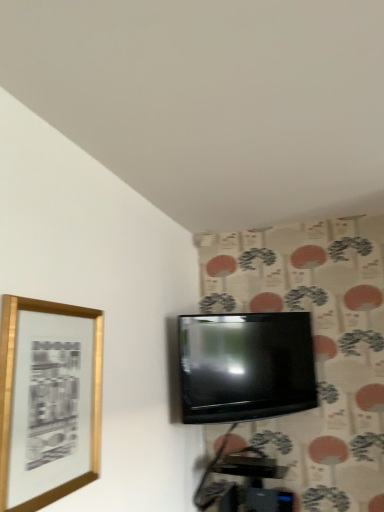
Question: Does gold metallic picture frame at left turn towards black glossy tv at center?

Choices:
 (A) no
 (B) yes

Answer: (A)

Question: Is gold metallic picture frame at left at the right side of black glossy tv at center?

Choices:
 (A) no
 (B) yes

Answer: (A)

Question: Is gold metallic picture frame at left behind black glossy tv at center?

Choices:
 (A) yes
 (B) no

Answer: (B)

Question: Can you confirm if gold metallic picture frame at left is smaller than black glossy tv at center?

Choices:
 (A) yes
 (B) no

Answer: (A)

Question: Can you confirm if gold metallic picture frame at left is shorter than black glossy tv at center?

Choices:
 (A) no
 (B) yes

Answer: (A)

Question: Is gold metallic picture frame at left far from black glossy tv at center?

Choices:
 (A) no
 (B) yes

Answer: (A)

Question: Is black glossy tv at center directly adjacent to gold metallic picture frame at left?

Choices:
 (A) yes
 (B) no

Answer: (B)

Question: Is black glossy tv at center smaller than gold metallic picture frame at left?

Choices:
 (A) no
 (B) yes

Answer: (A)

Question: Is black glossy tv at center wider than gold metallic picture frame at left?

Choices:
 (A) yes
 (B) no

Answer: (A)

Question: Is black glossy tv at center in front of gold metallic picture frame at left?

Choices:
 (A) no
 (B) yes

Answer: (A)

Question: Is black glossy tv at center oriented away from gold metallic picture frame at left?

Choices:
 (A) yes
 (B) no

Answer: (B)

Question: Can gold metallic picture frame at left be found inside black glossy tv at center?

Choices:
 (A) no
 (B) yes

Answer: (A)

Question: Is point (4, 325) closer or farther from the camera than point (248, 384)?

Choices:
 (A) closer
 (B) farther

Answer: (A)